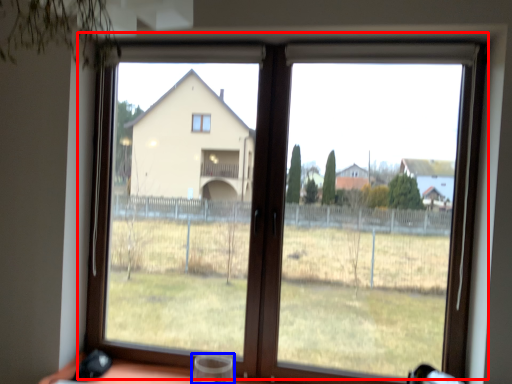
Question: Which of the following is the closest to the observer, window (highlighted by a red box) or wine glass (highlighted by a blue box)?

Choices:
 (A) window
 (B) wine glass

Answer: (B)